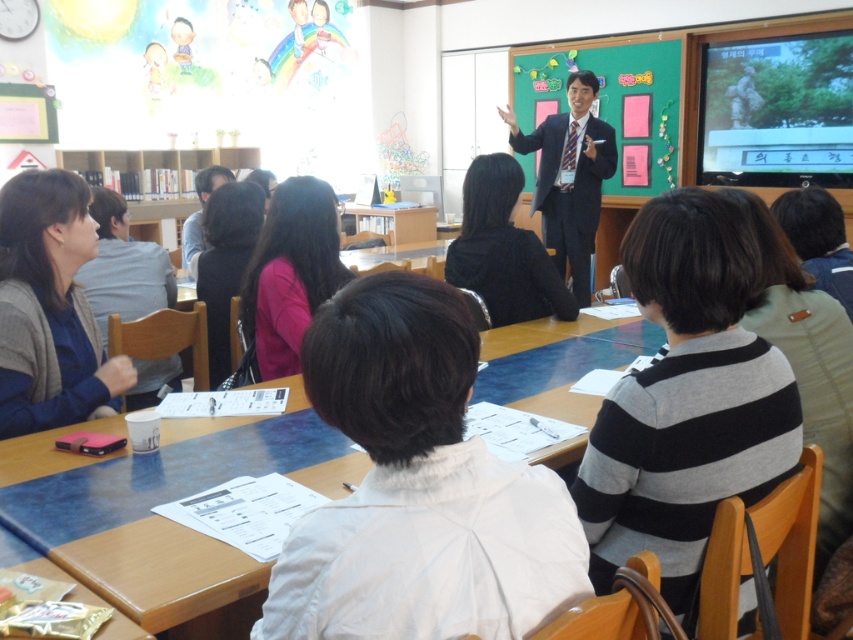
From the picture: Which is below, blue glossy table at center or matte black sweater at left?

Positioned lower is blue glossy table at center.

Is blue glossy table at center positioned behind matte black sweater at left?

No.

The height and width of the screenshot is (640, 853). Find the location of `blue glossy table at center`. blue glossy table at center is located at coordinates (166, 518).

Locate an element on the screen. This screenshot has height=640, width=853. blue glossy table at center is located at coordinates [x=166, y=518].

Is striped sweater at center positioned in front of blue glossy table at center?

No, striped sweater at center is further to the viewer.

Can you confirm if striped sweater at center is bigger than blue glossy table at center?

No, striped sweater at center is not bigger than blue glossy table at center.

The width and height of the screenshot is (853, 640). I want to click on striped sweater at center, so click(686, 397).

Looking at this image, how distant is matte black sweater at left from black suit at center?

They are 3.01 meters apart.

Is matte black sweater at left shorter than black suit at center?

Yes.

This screenshot has width=853, height=640. In order to click on matte black sweater at left in this screenshot , I will do `click(49, 308)`.